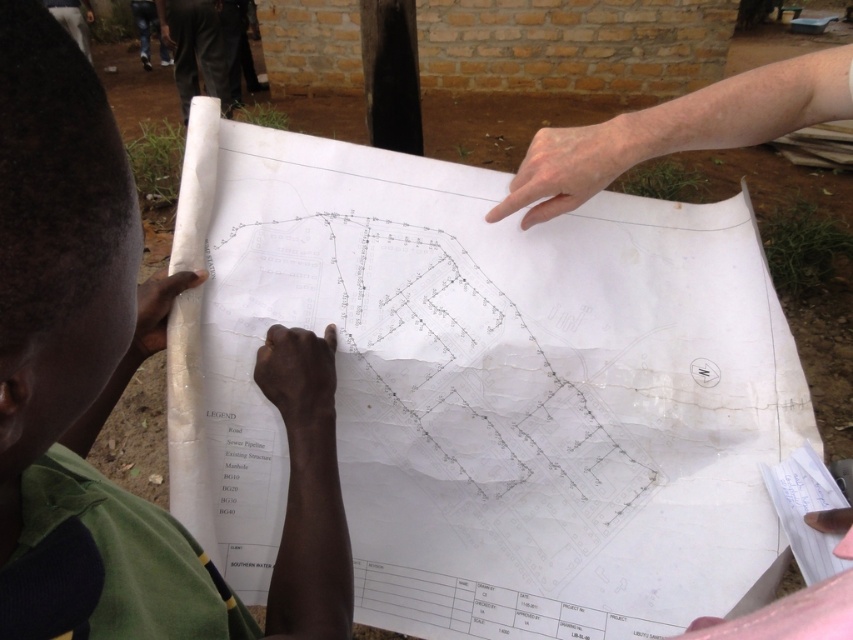
You are a construction worker who needs to identify clothing items in the scene. Which item is smaller in size between the green fabric shirt at lower left and the black fabric pants at upper left?

The green fabric shirt at lower left has a smaller size compared to the black fabric pants at upper left, so the green fabric shirt at lower left is the smaller one.

You are a construction worker standing in the middle of the scene. You need to hand a tool to the person wearing the green fabric shirt at lower left and the black fabric pants at upper left. Which person is closer to your current position?

The green fabric shirt at lower left is closer to your current position because it is to the right of the black fabric pants at upper left, indicating it is positioned nearer in the scene.